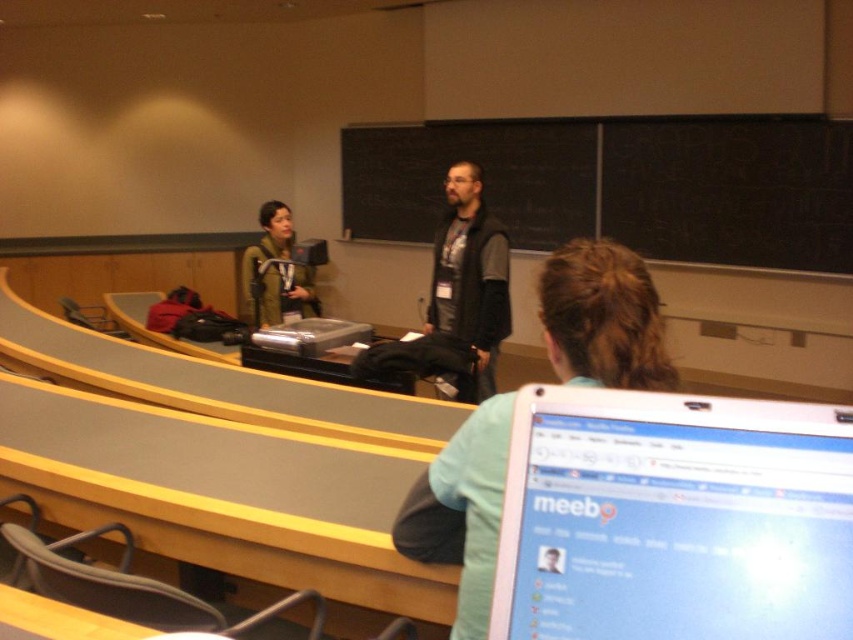
Can you confirm if dark gray jacket at center is wider than green matte jacket at center?

Incorrect, dark gray jacket at center's width does not surpass green matte jacket at center's.

Who is positioned more to the right, dark gray jacket at center or green matte jacket at center?

From the viewer's perspective, dark gray jacket at center appears more on the right side.

Locate an element on the screen. Image resolution: width=853 pixels, height=640 pixels. dark gray jacket at center is located at coordinates (602, 317).

Where is `dark gray jacket at center`? Image resolution: width=853 pixels, height=640 pixels. dark gray jacket at center is located at coordinates (602, 317).

Which of these two, white glossy laptop at lower right or dark gray vest at center, stands shorter?

white glossy laptop at lower right

Is white glossy laptop at lower right to the left of dark gray vest at center from the viewer's perspective?

No, white glossy laptop at lower right is not to the left of dark gray vest at center.

Which is in front, point (763, 442) or point (483, 282)?

Point (763, 442) is more forward.

This screenshot has height=640, width=853. Find the location of `white glossy laptop at lower right`. white glossy laptop at lower right is located at coordinates (674, 518).

Who is higher up, dark gray jacket at center or dark gray vest at center?

dark gray vest at center

Which is more to the right, dark gray jacket at center or dark gray vest at center?

From the viewer's perspective, dark gray vest at center appears more on the right side.

The height and width of the screenshot is (640, 853). What are the coordinates of `dark gray jacket at center` in the screenshot? It's located at (602, 317).

Where is `dark gray jacket at center`? The width and height of the screenshot is (853, 640). dark gray jacket at center is located at coordinates (602, 317).